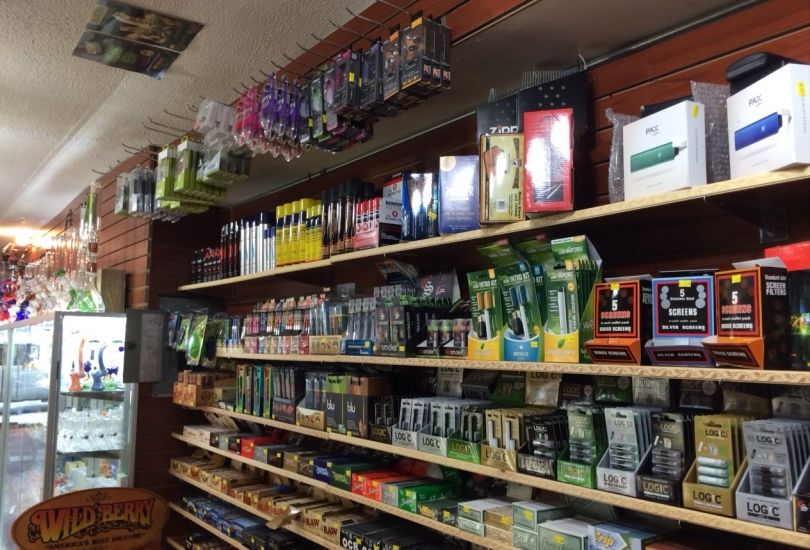
Locate an element on the screen. The image size is (810, 550). box is located at coordinates (681, 175).